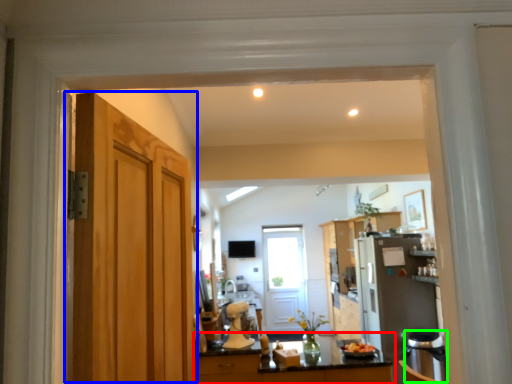
Question: Estimate the real-world distances between objects in this image. Which object is farther from countertop (highlighted by a red box), door (highlighted by a blue box) or dish washer (highlighted by a green box)?

Choices:
 (A) door
 (B) dish washer

Answer: (A)